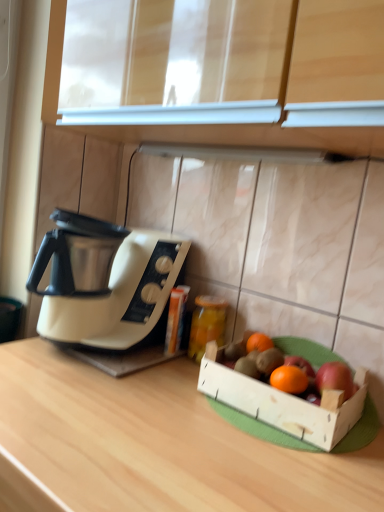
Where is `free region on the left part of wooden crate at right`? This screenshot has height=512, width=384. free region on the left part of wooden crate at right is located at coordinates (162, 403).